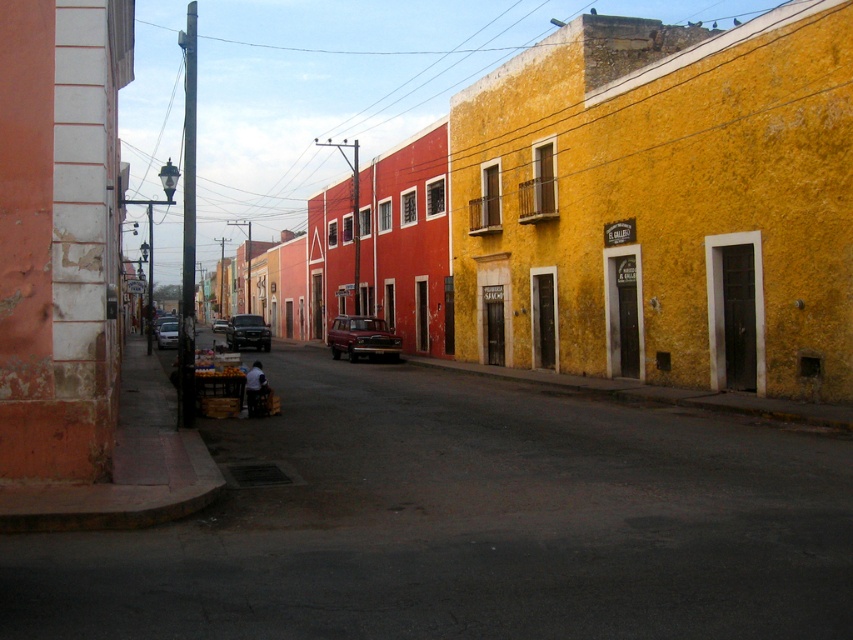
Question: Estimate the real-world distances between objects in this image. Which object is closer to the shiny red car at center?

Choices:
 (A) metallic silver truck at center
 (B) shiny black car at center

Answer: (B)

Question: Which point is farther to the camera?

Choices:
 (A) (216, 320)
 (B) (252, 314)
 (C) (386, 355)

Answer: (A)

Question: Based on their relative distances, which object is nearer to the metallic silver truck at center?

Choices:
 (A) shiny red car at center
 (B) shiny black car at center

Answer: (B)

Question: Where is shiny black car at center located in relation to metallic silver car at center-left in the image?

Choices:
 (A) above
 (B) below

Answer: (A)

Question: Does metallic silver car at center-left have a greater width compared to metallic silver truck at center?

Choices:
 (A) yes
 (B) no

Answer: (B)

Question: Can you confirm if shiny black car at center is positioned to the right of metallic silver truck at center?

Choices:
 (A) no
 (B) yes

Answer: (B)